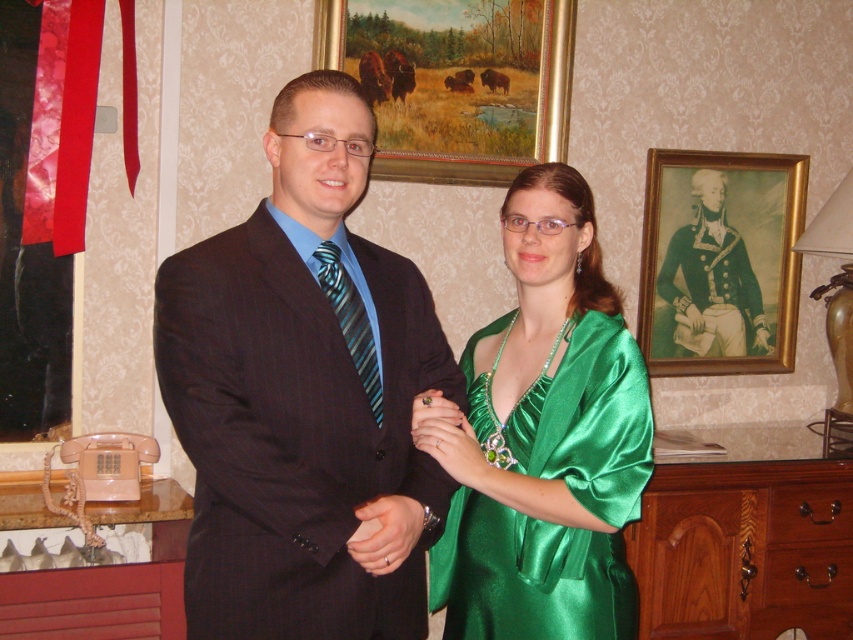
Does gold-framed portrait at upper right come in front of blue striped tie at center?

No.

How distant is gold-framed portrait at upper right from blue striped tie at center?

gold-framed portrait at upper right is 5.81 feet from blue striped tie at center.

Is point (720, 252) farther from camera compared to point (341, 310)?

That is True.

The height and width of the screenshot is (640, 853). I want to click on gold-framed portrait at upper right, so click(x=720, y=260).

Is matte black suit at center below gold-framed painting of bison at upper center?

Yes, matte black suit at center is below gold-framed painting of bison at upper center.

What do you see at coordinates (305, 396) in the screenshot?
I see `matte black suit at center` at bounding box center [305, 396].

The height and width of the screenshot is (640, 853). Find the location of `matte black suit at center`. matte black suit at center is located at coordinates 305,396.

Can you confirm if brown wood dresser at lower right is taller than blue striped tie at center?

Yes, brown wood dresser at lower right is taller than blue striped tie at center.

Who is more forward, (766, 513) or (376, 406)?

Point (376, 406) is more forward.

Identify the location of brown wood dresser at lower right. This screenshot has width=853, height=640. (746, 540).